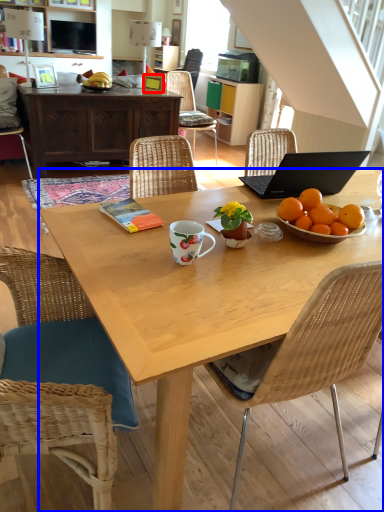
Question: Among these objects, which one is farthest to the camera, picture frame (highlighted by a red box) or desk (highlighted by a blue box)?

Choices:
 (A) picture frame
 (B) desk

Answer: (A)